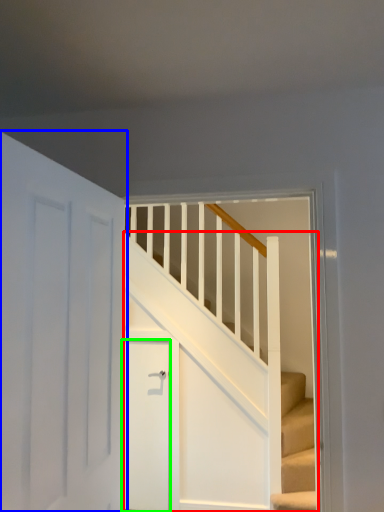
Question: Estimate the real-world distances between objects in this image. Which object is farther from stairs (highlighted by a red box), door (highlighted by a blue box) or door (highlighted by a green box)?

Choices:
 (A) door
 (B) door

Answer: (A)